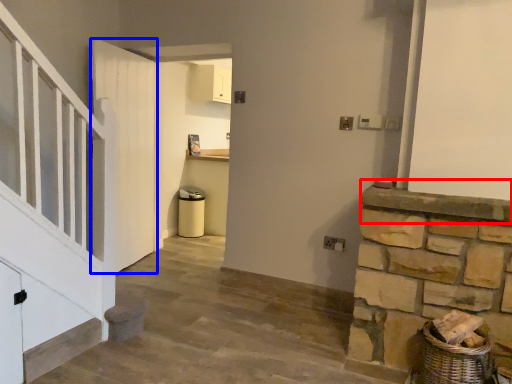
Question: Which object appears farthest to the camera in this image, mantle (highlighted by a red box) or door (highlighted by a blue box)?

Choices:
 (A) mantle
 (B) door

Answer: (B)